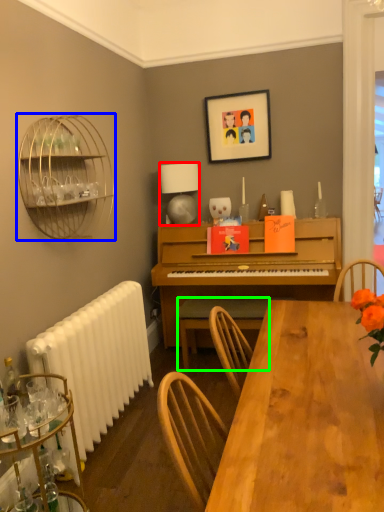
Question: Considering the real-world distances, which object is closest to lamp (highlighted by a red box)? bird cage (highlighted by a blue box) or chair (highlighted by a green box).

Choices:
 (A) bird cage
 (B) chair

Answer: (B)